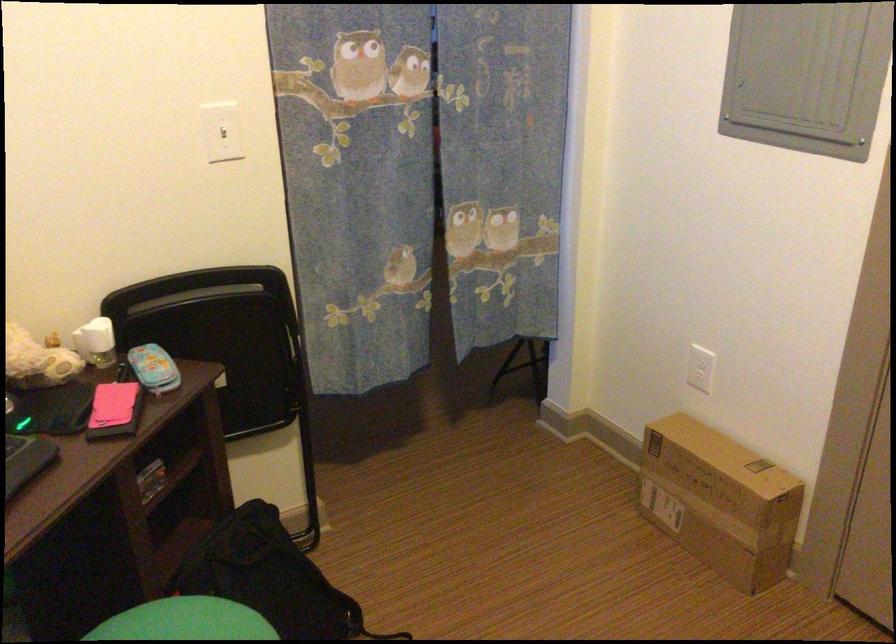
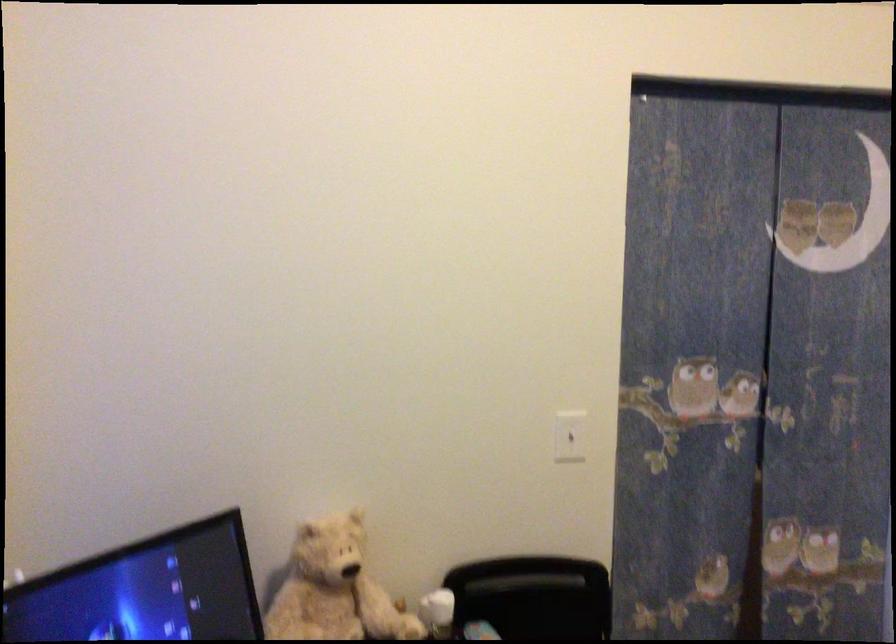
Based on the continuous images, in which direction is the camera rotating?

The camera rotated toward left-up.